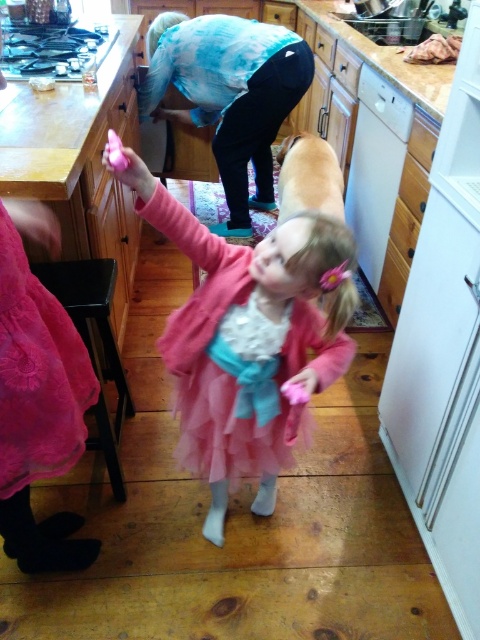
Question: From the image, what is the correct spatial relationship of pink fluffy dress at center in relation to pink tulle ballet skirt at lower left?

Choices:
 (A) below
 (B) above

Answer: (A)

Question: Which point is farther to the camera?

Choices:
 (A) pyautogui.click(x=105, y=442)
 (B) pyautogui.click(x=264, y=326)
 (C) pyautogui.click(x=29, y=392)
 (D) pyautogui.click(x=168, y=33)

Answer: (D)

Question: Estimate the real-world distances between objects in this image. Which object is farther from the velvet pink cushion at lower left?

Choices:
 (A) soft pink fur at center
 (B) blue tie-dye shirt at upper center
 (C) pink tulle ballet skirt at lower left

Answer: (B)

Question: Among these objects, which one is nearest to the camera?

Choices:
 (A) velvet pink cushion at lower left
 (B) blue tie-dye shirt at upper center
 (C) pink tulle ballet skirt at lower left
 (D) pink fluffy dress at center

Answer: (C)

Question: Observing the image, what is the correct spatial positioning of pink tulle ballet skirt at lower left in reference to soft pink fur at center?

Choices:
 (A) right
 (B) left

Answer: (B)

Question: Is pink fluffy dress at center further to camera compared to pink tulle ballet skirt at lower left?

Choices:
 (A) yes
 (B) no

Answer: (A)